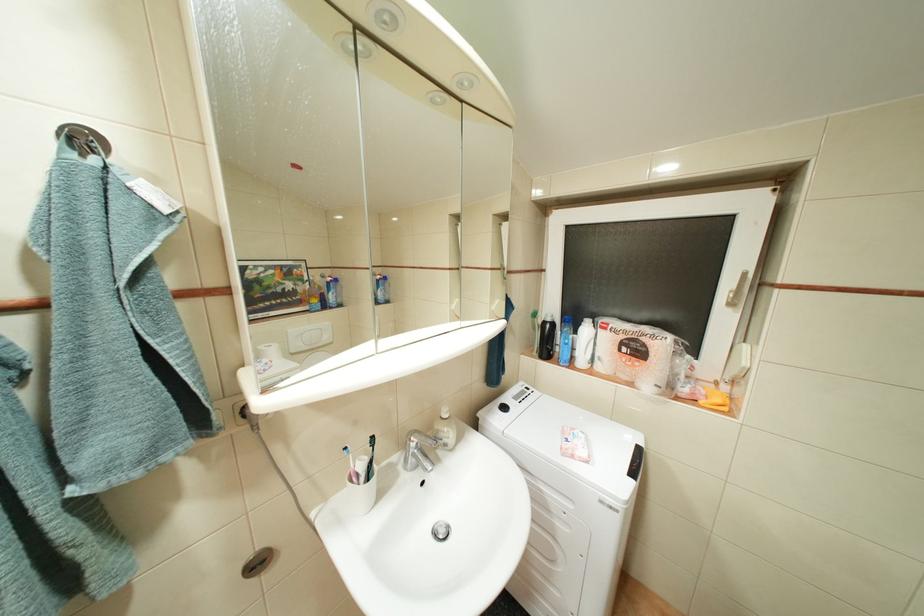
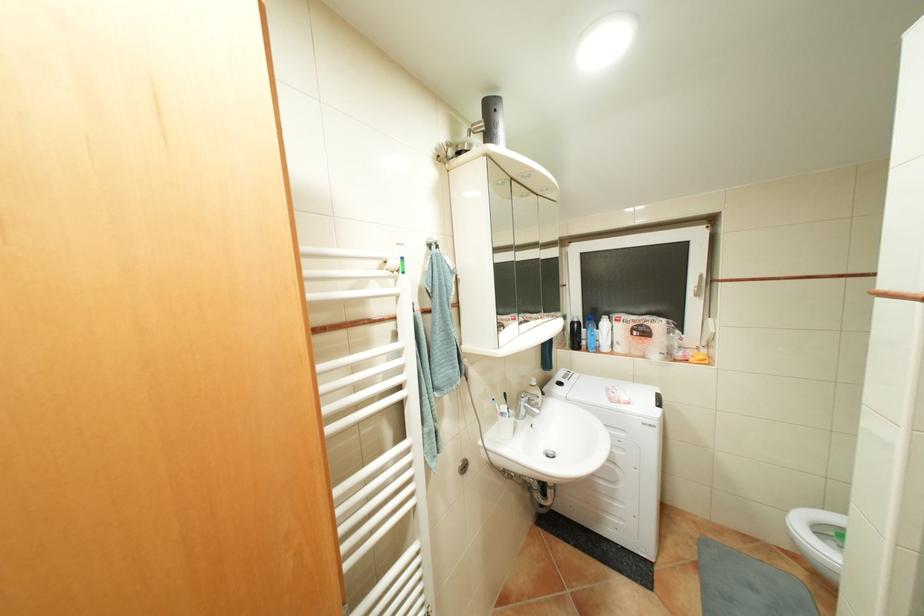
Find the pixel in the second image that matches the point at 694,390 in the first image.

(688, 354)